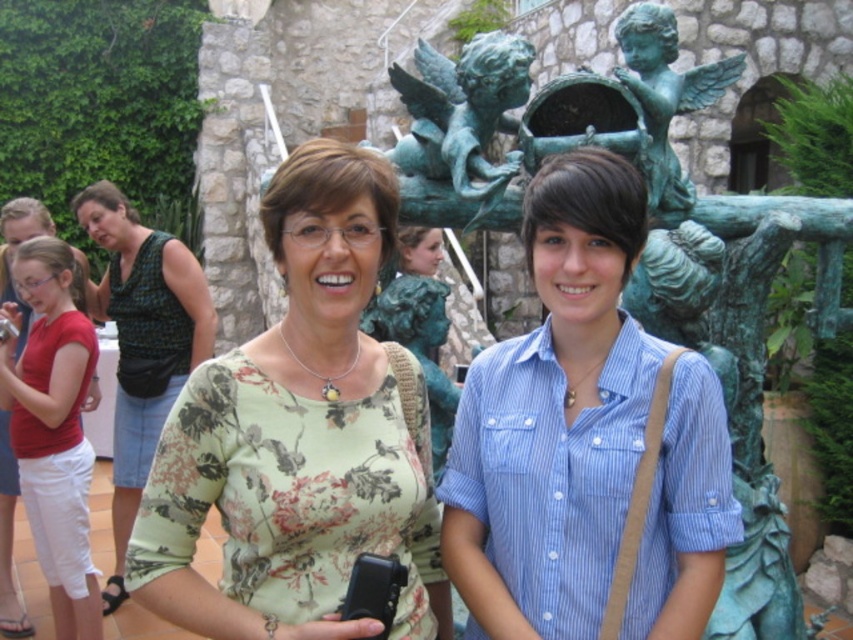
You are a photographer trying to adjust the composition of your photo. You have two subjects in focus now, the blue striped shirt at center and the green printed dress at left. Which one should you move upward to avoid overlapping with the other?

The blue striped shirt at center is positioned under the green printed dress at left, so you should move the blue striped shirt at center upward to avoid overlapping with the green printed dress at left.

You are a photographer trying to capture a group photo. You notice the blue striped shirt at center and the green printed dress at left. Which one is blocking the view of the other?

The blue striped shirt at center is in front of the green printed dress at left, so it is blocking the view of the green printed dress at left.